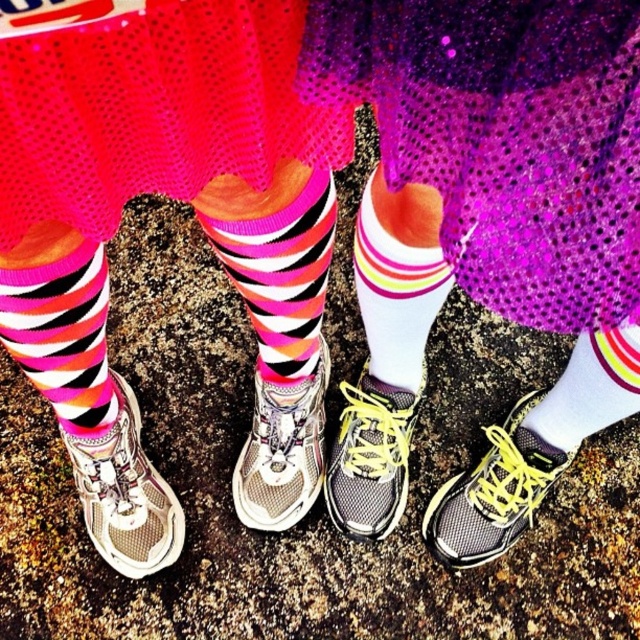
Question: Among these points, which one is nearest to the camera?

Choices:
 (A) (92, 308)
 (B) (556, 36)
 (C) (376, 432)
 (D) (269, 444)

Answer: (B)

Question: Which point is closer to the camera taking this photo?

Choices:
 (A) (588, 160)
 (B) (45, 326)
 (C) (426, 289)

Answer: (A)

Question: Is purple sequined skirt at center smaller than textured mesh sneaker at center?

Choices:
 (A) yes
 (B) no

Answer: (B)

Question: Can you confirm if multicolored striped sock at center is positioned to the left of white mesh sneaker at lower left?

Choices:
 (A) no
 (B) yes

Answer: (A)

Question: Can you confirm if pink striped sock at lower left is positioned to the left of white mesh sneaker at lower left?

Choices:
 (A) yes
 (B) no

Answer: (B)

Question: Among these objects, which one is farthest from the camera?

Choices:
 (A) white mesh sneaker at center
 (B) purple sequined skirt at center
 (C) matte gray sneaker at lower right

Answer: (C)